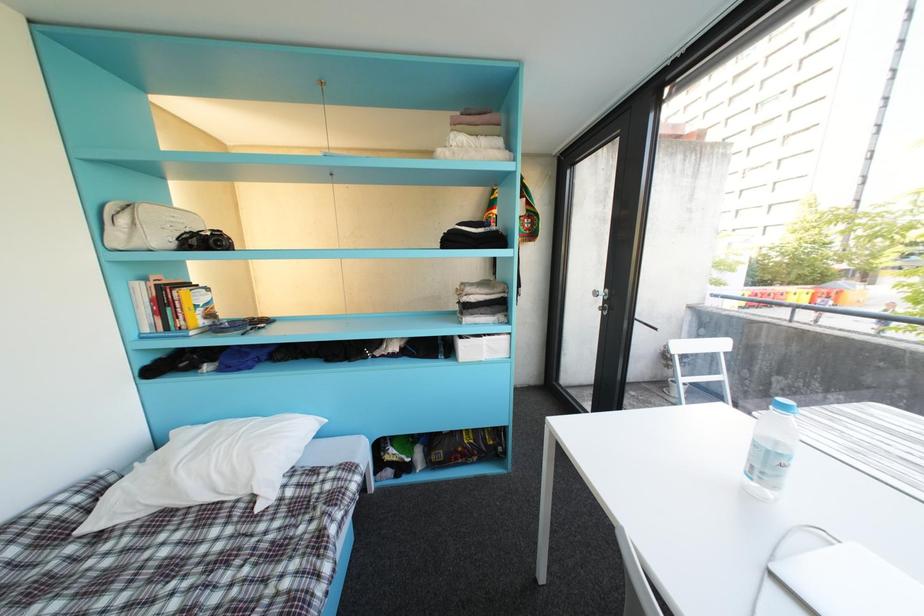
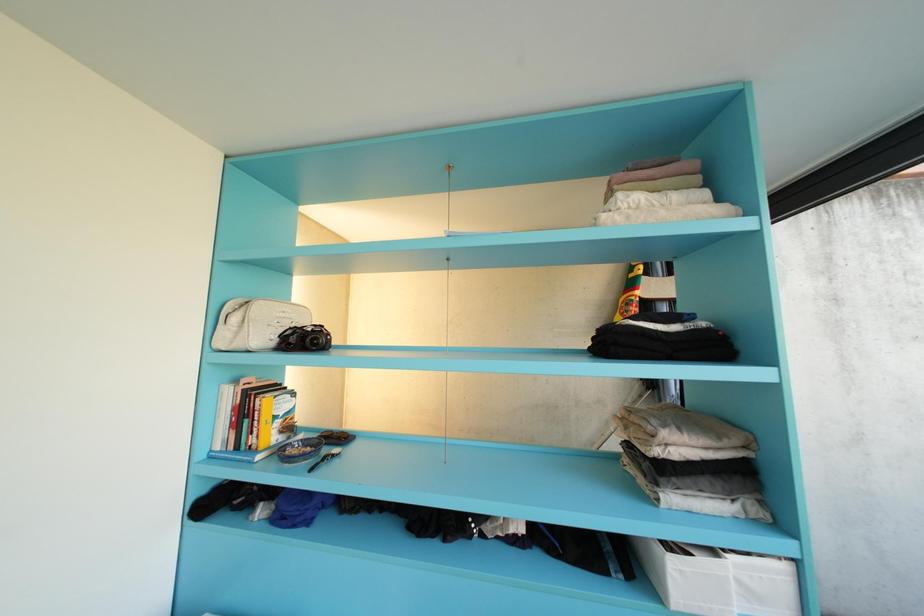
The images are taken continuously from a first-person perspective. In which direction are you moving?

The cameraman walked toward left, forward.